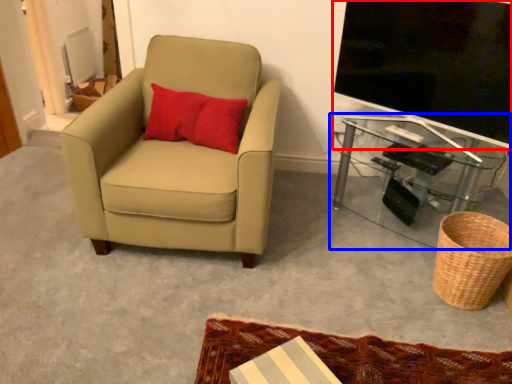
Question: Which point is further to the camera, television (highlighted by a red box) or table (highlighted by a blue box)?

Choices:
 (A) television
 (B) table

Answer: (B)